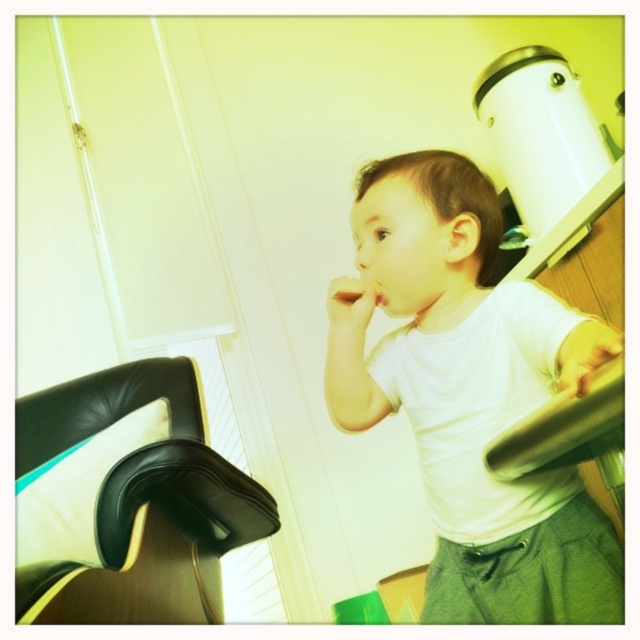
You are a robot trying to navigate to a specific location in the room. You need to move from point A to point B. Point A is at coordinates point (337, 284) and point B is at coordinates point (92, 372). According to the scene description, is point A closer to the child than point B?

Point A is in front of point B, so point A is closer to the child than point B.

You are a photographer setting up a shoot in this room. You need to place a small tripod between the white matte shirt at upper right and the black leather chair at lower left. Based on their positions, where should you place the tripod?

The white matte shirt at upper right is positioned over the black leather chair at lower left, so the tripod should be placed between them, below the white matte shirt at upper right and above the black leather chair at lower left.

You are a photographer setting up a shoot in this room. You need to position a light source between the white matte shirt at upper right and the black leather chair at lower left. Based on their positions, which object should the light be closer to?

The white matte shirt at upper right is closer to the viewer than the black leather chair at lower left, so the light should be positioned closer to the white matte shirt at upper right to ensure proper illumination.